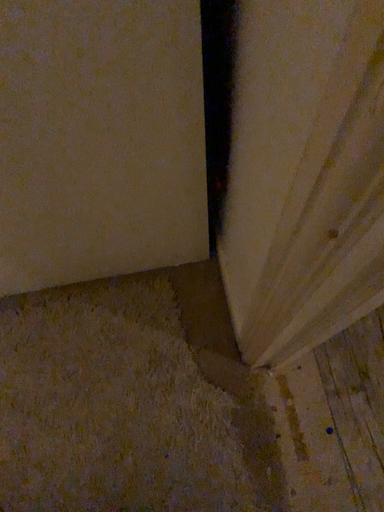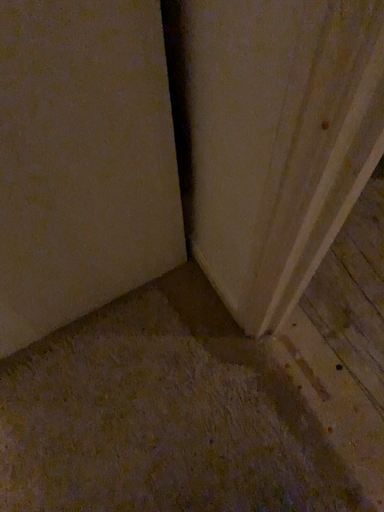
Question: How did the camera likely rotate when shooting the video?

Choices:
 (A) rotated left
 (B) rotated right

Answer: (B)